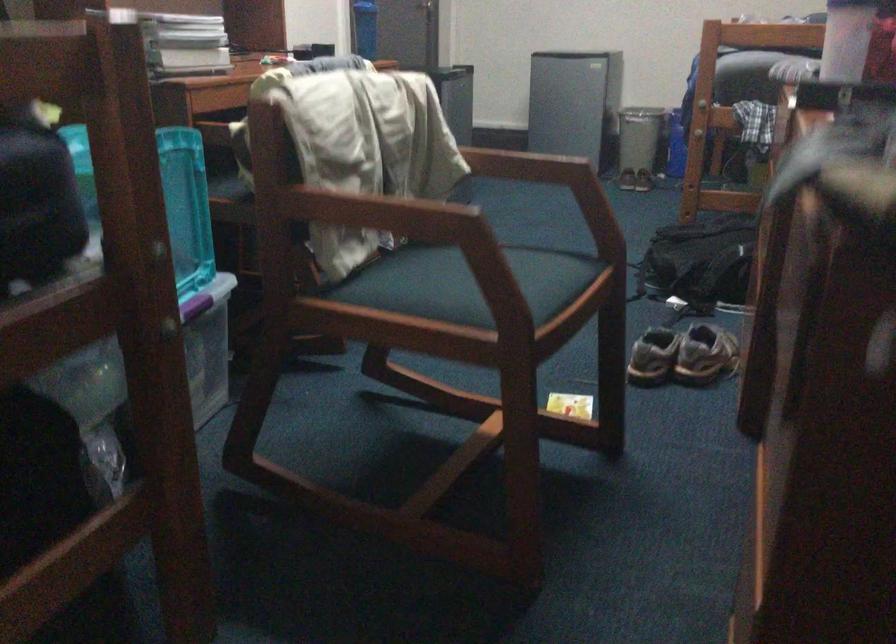
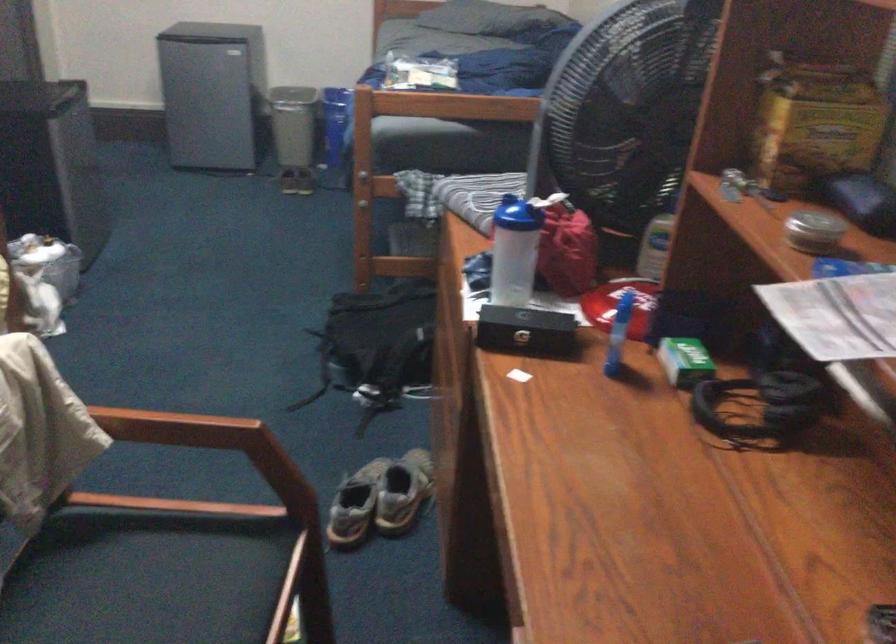
In the second image, find the point that corresponds to the point at 658,357 in the first image.

(355, 505)